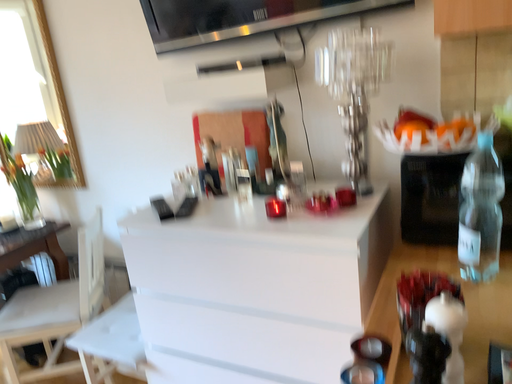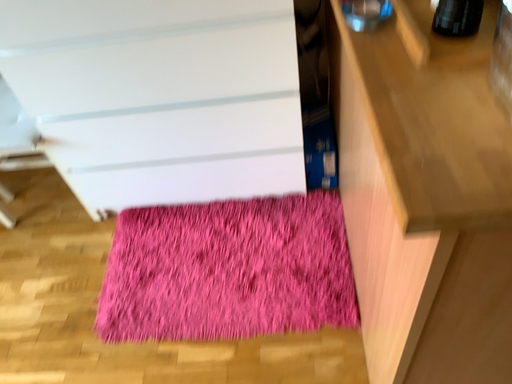
Question: Which way did the camera rotate in the video?

Choices:
 (A) rotated left
 (B) rotated right

Answer: (B)